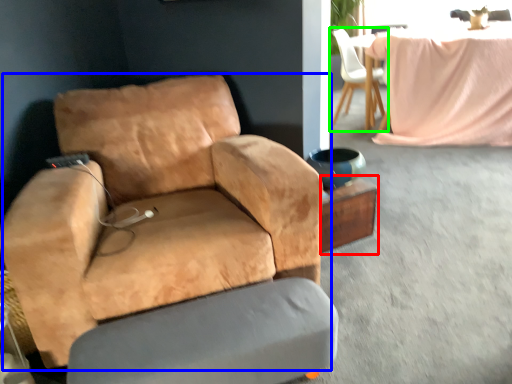
Question: Considering the real-world distances, which object is farthest from side table (highlighted by a red box)? chair (highlighted by a blue box) or chair (highlighted by a green box)?

Choices:
 (A) chair
 (B) chair

Answer: (B)